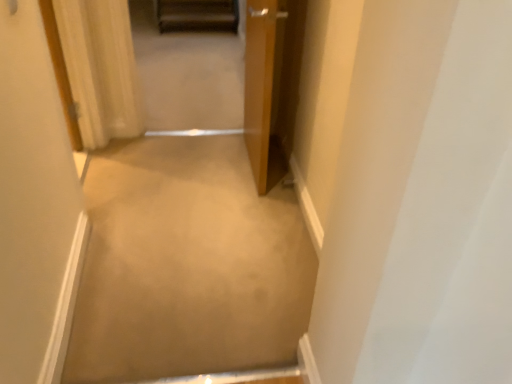
At what (x,y) coordinates should I click in order to perform the action: click on white wood door at left, placed as the first door when sorted from left to right. Please return your answer as a coordinate pair (x, y). Looking at the image, I should click on (34, 204).

This screenshot has width=512, height=384. In order to click on wooden door at upper left in this screenshot , I will do `click(187, 74)`.

Which point is more distant from viewer, (42, 98) or (102, 312)?

The point (102, 312) is more distant.

Is there a large distance between white wood door at left, placed as the first door when sorted from left to right, and beige carpet at center?

No, white wood door at left, placed as the first door when sorted from left to right, is in close proximity to beige carpet at center.

Considering the relative sizes of white wood door at left, placed as the first door when sorted from left to right, and beige carpet at center in the image provided, is white wood door at left, placed as the first door when sorted from left to right, taller than beige carpet at center?

Indeed, white wood door at left, placed as the first door when sorted from left to right, has a greater height compared to beige carpet at center.

How far apart are white wood door at left, placed as the first door when sorted from left to right, and beige carpet at center?

white wood door at left, placed as the first door when sorted from left to right, is 20.28 inches away from beige carpet at center.

Is wooden door at upper left far away from beige carpet at center?

wooden door at upper left is far away from beige carpet at center.

Between point (239, 64) and point (129, 210), which one is positioned in front?

The point (129, 210) is closer to the camera.

Can you tell me how much wooden door at upper left and beige carpet at center differ in facing direction?

The facing directions of wooden door at upper left and beige carpet at center are 176 degrees apart.

Which object is positioned more to the right, wooden door at upper left or beige carpet at center?

beige carpet at center is more to the right.

Between point (186, 105) and point (36, 154), which one is positioned in front?

The point (36, 154) is closer to the camera.

From the image's perspective, who appears lower, wooden door at upper left or white wood door at left, which is counted as the 2th door, starting from the right?

white wood door at left, which is counted as the 2th door, starting from the right.

In the image, there is a white wood door at left, which is counted as the 2th door, starting from the right. Where is `passage above it (from the image's perspective)`? passage above it (from the image's perspective) is located at coordinates (187, 74).

Is wooden door at upper left wider or thinner than white wood door at left, which is counted as the 2th door, starting from the right?

wooden door at upper left is wider than white wood door at left, which is counted as the 2th door, starting from the right.

Locate an element on the screen. plain in front of the wooden door at center, placed as the first door when sorted from right to left is located at coordinates (187, 265).

How far apart are beige carpet at center and wooden door at center, placed as the first door when sorted from right to left?

beige carpet at center and wooden door at center, placed as the first door when sorted from right to left, are 64.39 centimeters apart.

Considering the positions of objects beige carpet at center and wooden door at center, positioned as the second door in left-to-right order, in the image provided, who is more to the right, beige carpet at center or wooden door at center, positioned as the second door in left-to-right order,?

From the viewer's perspective, wooden door at center, positioned as the second door in left-to-right order, appears more on the right side.

From a real-world perspective, is beige carpet at center positioned above or below wooden door at center, positioned as the second door in left-to-right order?

Clearly, from a real-world perspective, beige carpet at center is below wooden door at center, positioned as the second door in left-to-right order.

From the image's perspective, does beige carpet at center appear higher than white wood door at left, which is counted as the 2th door, starting from the right?

No.

Is beige carpet at center positioned beyond the bounds of white wood door at left, placed as the first door when sorted from left to right?

Yes, beige carpet at center is located beyond the bounds of white wood door at left, placed as the first door when sorted from left to right.

Consider the image. Can you confirm if beige carpet at center is thinner than white wood door at left, which is counted as the 2th door, starting from the right?

No.

Can you see beige carpet at center touching white wood door at left, placed as the first door when sorted from left to right?

No, beige carpet at center is not beside white wood door at left, placed as the first door when sorted from left to right.

Is beige carpet at center further to the viewer compared to wooden door at upper left?

No, it is in front of wooden door at upper left.

Based on the photo, is beige carpet at center inside or outside of wooden door at upper left?

beige carpet at center is outside wooden door at upper left.

Which of these two, beige carpet at center or wooden door at upper left, is wider?

Wider between the two is wooden door at upper left.

From the image's perspective, between beige carpet at center and wooden door at upper left, which one is located above?

From the image's view, wooden door at upper left is above.

Is wooden door at center, positioned as the second door in left-to-right order, inside wooden door at upper left?

No, wooden door at upper left does not contain wooden door at center, positioned as the second door in left-to-right order.

Looking at this image, considering the sizes of objects wooden door at upper left and wooden door at center, placed as the first door when sorted from right to left, in the image provided, who is wider, wooden door at upper left or wooden door at center, placed as the first door when sorted from right to left,?

wooden door at upper left.

What's the angular difference between wooden door at upper left and wooden door at center, placed as the first door when sorted from right to left,'s facing directions?

wooden door at upper left and wooden door at center, placed as the first door when sorted from right to left, are facing 93.2 degrees away from each other.

Could you measure the distance between wooden door at upper left and wooden door at center, placed as the first door when sorted from right to left?

wooden door at upper left and wooden door at center, placed as the first door when sorted from right to left, are 1.52 meters apart from each other.

The image size is (512, 384). In order to click on the 2nd door directly above the beige carpet at center (from a real-world perspective) in this screenshot , I will do tap(34, 204).

This screenshot has width=512, height=384. I want to click on plain located in front of the wooden door at upper left, so pos(187,265).

From the image, which object appears to be farther from wooden door at upper left, wooden door at center, positioned as the second door in left-to-right order, or white wood door at left, placed as the first door when sorted from left to right?

white wood door at left, placed as the first door when sorted from left to right, is positioned further to the anchor wooden door at upper left.

Consider the image. Estimate the real-world distances between objects in this image. Which object is further from wooden door at center, positioned as the second door in left-to-right order, wooden door at upper left or beige carpet at center?

Among the two, wooden door at upper left is located further to wooden door at center, positioned as the second door in left-to-right order.

Considering their positions, is beige carpet at center positioned closer to wooden door at center, positioned as the second door in left-to-right order, than wooden door at upper left?

Based on the image, beige carpet at center appears to be nearer to wooden door at center, positioned as the second door in left-to-right order.

Based on their spatial positions, is wooden door at upper left or white wood door at left, placed as the first door when sorted from left to right, further from wooden door at center, positioned as the second door in left-to-right order?

Among the two, wooden door at upper left is located further to wooden door at center, positioned as the second door in left-to-right order.

Estimate the real-world distances between objects in this image. Which object is closer to beige carpet at center, white wood door at left, which is counted as the 2th door, starting from the right, or wooden door at center, positioned as the second door in left-to-right order?

Among the two, white wood door at left, which is counted as the 2th door, starting from the right, is located nearer to beige carpet at center.

Which object lies further to the anchor point white wood door at left, placed as the first door when sorted from left to right, wooden door at center, placed as the first door when sorted from right to left, or beige carpet at center?

wooden door at center, placed as the first door when sorted from right to left, is positioned further to the anchor white wood door at left, placed as the first door when sorted from left to right.

Estimate the real-world distances between objects in this image. Which object is further from wooden door at upper left, white wood door at left, which is counted as the 2th door, starting from the right, or beige carpet at center?

white wood door at left, which is counted as the 2th door, starting from the right, is positioned further to the anchor wooden door at upper left.

When comparing their distances from wooden door at upper left, does white wood door at left, placed as the first door when sorted from left to right, or wooden door at center, placed as the first door when sorted from right to left, seem further?

white wood door at left, placed as the first door when sorted from left to right, is further to wooden door at upper left.

Identify the location of door positioned between white wood door at left, placed as the first door when sorted from left to right, and wooden door at upper left from near to far. This screenshot has width=512, height=384. (259, 83).

At what (x,y) coordinates should I click in order to perform the action: click on plain located between white wood door at left, placed as the first door when sorted from left to right, and wooden door at center, positioned as the second door in left-to-right order, in the left-right direction. Please return your answer as a coordinate pair (x, y). This screenshot has height=384, width=512. Looking at the image, I should click on click(x=187, y=265).